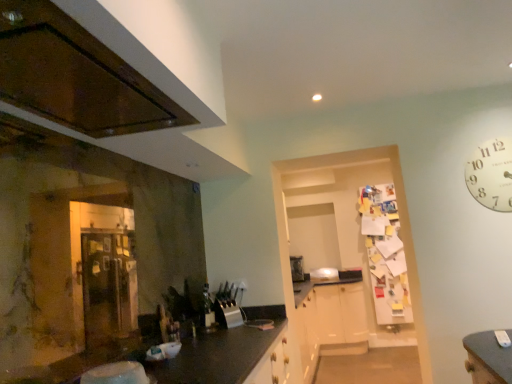
Image resolution: width=512 pixels, height=384 pixels. What do you see at coordinates (297, 269) in the screenshot? I see `satin silver toaster at center` at bounding box center [297, 269].

Image resolution: width=512 pixels, height=384 pixels. Find the location of `satin silver toaster at center`. satin silver toaster at center is located at coordinates (297, 269).

The width and height of the screenshot is (512, 384). Identify the location of glossy wood cabinetry at upper left. (108, 51).

Image resolution: width=512 pixels, height=384 pixels. Identify the location of white paper clock at upper right. (490, 174).

Is point (494, 155) positioned in front of point (84, 43)?

No, it is behind (84, 43).

Relative to glossy wood cabinetry at upper left, is white paper clock at upper right in front or behind?

white paper clock at upper right is positioned farther from the viewer than glossy wood cabinetry at upper left.

Between white paper clock at upper right and glossy wood cabinetry at upper left, which one has smaller size?

white paper clock at upper right.

From the image's perspective, is white paper clock at upper right located above glossy wood cabinetry at upper left?

No, from the image's perspective, white paper clock at upper right is not on top of glossy wood cabinetry at upper left.

Considering the points (296, 276) and (497, 139), which point is behind, point (296, 276) or point (497, 139)?

Point (296, 276)

From the picture: Can you confirm if satin silver toaster at center is smaller than white paper clock at upper right?

Incorrect, satin silver toaster at center is not smaller in size than white paper clock at upper right.

From a real-world perspective, is satin silver toaster at center positioned above or below white paper clock at upper right?

In terms of real-world spatial position, satin silver toaster at center is below white paper clock at upper right.

Measure the distance from satin silver toaster at center to white paper clock at upper right.

They are 5.36 feet apart.

From the image's perspective, who appears lower, glossy wood cabinetry at upper left or satin silver toaster at center?

From the image's view, satin silver toaster at center is below.

Is glossy wood cabinetry at upper left with satin silver toaster at center?

No, glossy wood cabinetry at upper left is not with satin silver toaster at center.

Find the location of a particular element. appliance lying behind the glossy wood cabinetry at upper left is located at coordinates pos(297,269).

From the image's perspective, between white paper clock at upper right and satin silver toaster at center, who is located below?

From the image's view, satin silver toaster at center is below.

Considering the sizes of objects white paper clock at upper right and satin silver toaster at center in the image provided, who is smaller, white paper clock at upper right or satin silver toaster at center?

white paper clock at upper right is smaller.

In terms of height, does white paper clock at upper right look taller or shorter compared to satin silver toaster at center?

Clearly, white paper clock at upper right is taller compared to satin silver toaster at center.

Can we say white paper clock at upper right lies outside satin silver toaster at center?

Yes, white paper clock at upper right is not within satin silver toaster at center.

How many degrees apart are the facing directions of satin silver toaster at center and glossy wood cabinetry at upper left?

The facing directions of satin silver toaster at center and glossy wood cabinetry at upper left are 92.4 degrees apart.

Can you confirm if satin silver toaster at center is thinner than glossy wood cabinetry at upper left?

Yes, satin silver toaster at center is thinner than glossy wood cabinetry at upper left.

Does satin silver toaster at center have a greater height compared to glossy wood cabinetry at upper left?

Yes, satin silver toaster at center is taller than glossy wood cabinetry at upper left.

Based on the photo, is satin silver toaster at center positioned with its back to glossy wood cabinetry at upper left?

That's not correct — satin silver toaster at center is not looking away from glossy wood cabinetry at upper left.

How many degrees apart are the facing directions of glossy wood cabinetry at upper left and white paper clock at upper right?

The facing directions of glossy wood cabinetry at upper left and white paper clock at upper right are 89.9 degrees apart.

From a real-world perspective, is glossy wood cabinetry at upper left physically located above or below white paper clock at upper right?

glossy wood cabinetry at upper left is above white paper clock at upper right.

Considering the sizes of objects glossy wood cabinetry at upper left and white paper clock at upper right in the image provided, who is thinner, glossy wood cabinetry at upper left or white paper clock at upper right?

With smaller width is white paper clock at upper right.

Is glossy wood cabinetry at upper left at the right side of white paper clock at upper right?

In fact, glossy wood cabinetry at upper left is to the left of white paper clock at upper right.

You are a GUI agent. You are given a task and a screenshot of the screen. Output one action in this format:
    pyautogui.click(x=<x>, y=<y>)
    Task: Click on the clock lying behind the glossy wood cabinetry at upper left
    
    Given the screenshot: What is the action you would take?
    pyautogui.click(x=490, y=174)

Locate an element on the screen. The image size is (512, 384). clock on the right of satin silver toaster at center is located at coordinates (490, 174).

Estimate the real-world distances between objects in this image. Which object is closer to glossy wood cabinetry at upper left, white paper clock at upper right or satin silver toaster at center?

The object closer to glossy wood cabinetry at upper left is white paper clock at upper right.

In the scene shown: Looking at the image, which one is located further to satin silver toaster at center, white paper clock at upper right or glossy wood cabinetry at upper left?

The object further to satin silver toaster at center is glossy wood cabinetry at upper left.

Based on their spatial positions, is glossy wood cabinetry at upper left or white paper clock at upper right closer to satin silver toaster at center?

Among the two, white paper clock at upper right is located nearer to satin silver toaster at center.

Which object lies further to the anchor point glossy wood cabinetry at upper left, satin silver toaster at center or white paper clock at upper right?

Among the two, satin silver toaster at center is located further to glossy wood cabinetry at upper left.

When comparing their distances from white paper clock at upper right, does glossy wood cabinetry at upper left or satin silver toaster at center seem closer?

The object closer to white paper clock at upper right is satin silver toaster at center.

Looking at the image, which one is located closer to white paper clock at upper right, satin silver toaster at center or glossy wood cabinetry at upper left?

The object closer to white paper clock at upper right is satin silver toaster at center.

This screenshot has height=384, width=512. Find the location of `clock between glossy wood cabinetry at upper left and satin silver toaster at center along the z-axis`. clock between glossy wood cabinetry at upper left and satin silver toaster at center along the z-axis is located at coordinates (490, 174).